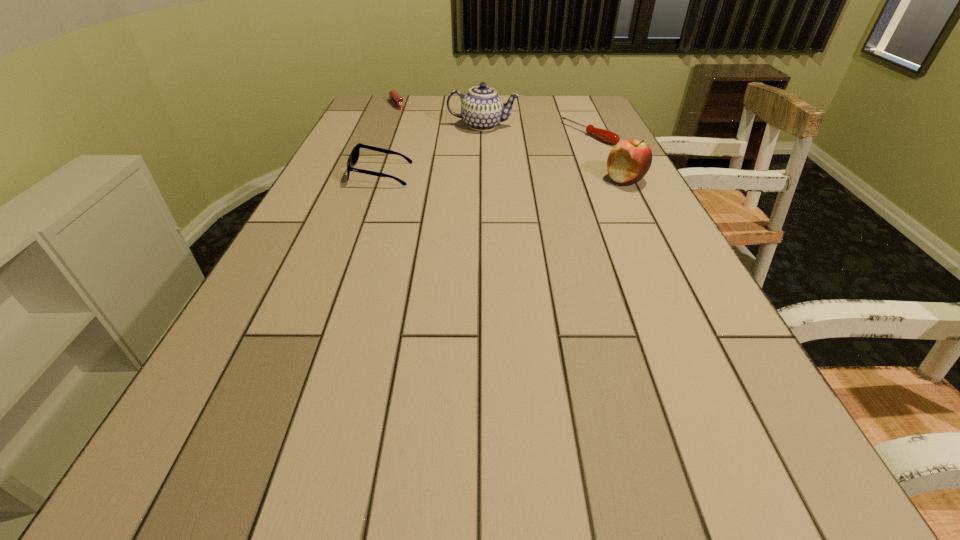
Image resolution: width=960 pixels, height=540 pixels. What are the coordinates of `vacant area that lies between the screwdriver and the third tallest object` in the screenshot? It's located at (485, 154).

Locate an element on the screen. The height and width of the screenshot is (540, 960). empty space that is in between the third object from right to left and the third tallest object is located at coordinates (432, 150).

Where is `vacant space in between the screwdriver and the sunglasses`? This screenshot has height=540, width=960. vacant space in between the screwdriver and the sunglasses is located at coordinates (485, 154).

Where is `vacant space that's between the farthest object and the chinaware`? This screenshot has width=960, height=540. vacant space that's between the farthest object and the chinaware is located at coordinates (440, 116).

Locate an element on the screen. The image size is (960, 540). the third closest object to the shortest object is located at coordinates coord(354,156).

Choose which object is the third nearest neighbor to the apple. Please provide its 2D coordinates. Your answer should be formatted as a tuple, i.e. [(x, y)], where the tuple contains the x and y coordinates of a point satisfying the conditions above.

[(354, 156)]

I want to click on blank space that satisfies the following two spatial constraints: 1. on the front side of the chinaware; 2. on the bitten side of the second tallest object, so click(483, 180).

This screenshot has height=540, width=960. I want to click on free location that satisfies the following two spatial constraints: 1. on the front side of the apple; 2. on the bitten side of the shortest object, so click(610, 180).

Identify the location of vacant space that satisfies the following two spatial constraints: 1. on the front side of the chinaware; 2. on the right side of the farthest object. The image size is (960, 540). (388, 126).

Locate an element on the screen. The width and height of the screenshot is (960, 540). vacant region that satisfies the following two spatial constraints: 1. on the front side of the second tallest object; 2. on the bitten side of the chinaware is located at coordinates (483, 180).